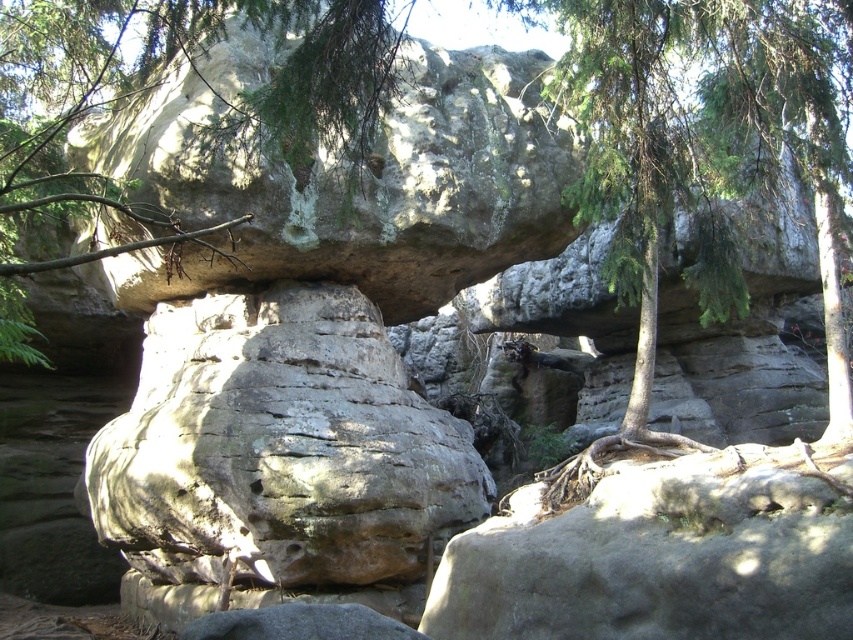
You are a geologist examining the rock formation. You notice the rough textured rock at center and the green textured rock at upper center. Which rock would you estimate to be smaller in size?

The rough textured rock at center has a smaller size compared to the green textured rock at upper center, so the rough textured rock at center is smaller.

Based on the scene description, which object is taller between the rough textured rock at center and the green textured rock at upper center?

The green textured rock at upper center is taller than the rough textured rock at center.

You are a hiker standing at the base of the rough textured rock at center. You want to take a photo of it with your camera, which has a maximum zoom range of 10 meters. Can you capture the entire rock formation in your photo without moving closer?

The rough textured rock at center is 14.27 meters away from the camera. Since your camera can only zoom up to 10 meters, you cannot capture the entire rock formation without moving closer.